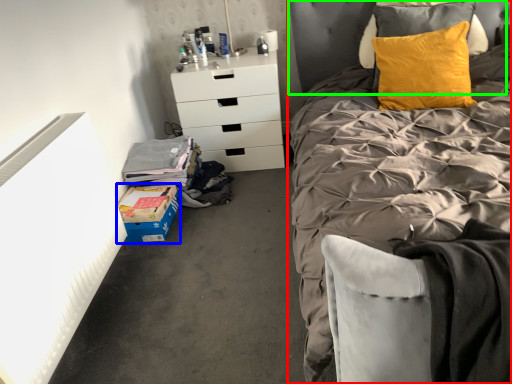
Question: Which object is positioned closest to bed (highlighted by a red box)? Select from cardboard box (highlighted by a blue box) and headboard (highlighted by a green box).

Choices:
 (A) cardboard box
 (B) headboard

Answer: (B)